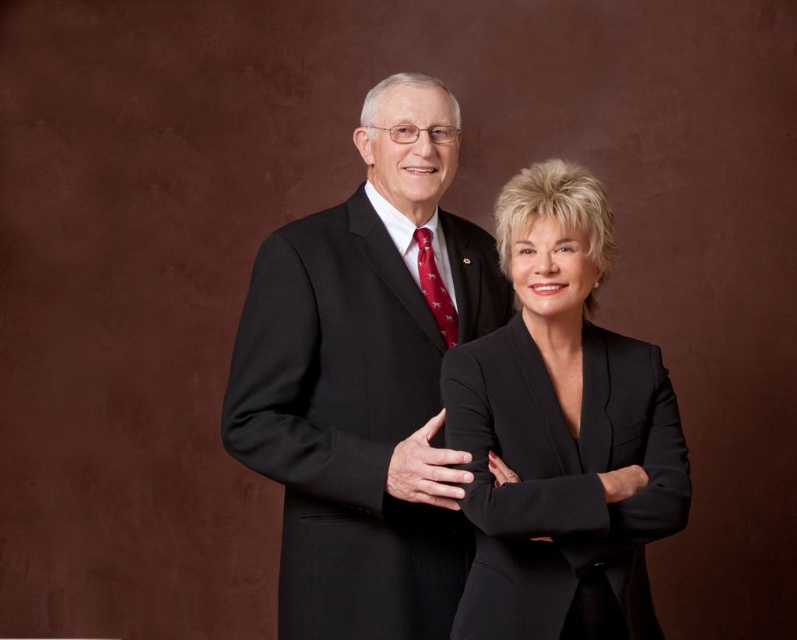
Can you confirm if matte black suit at center is positioned below black matte suit at center?

Incorrect, matte black suit at center is not positioned below black matte suit at center.

Which is behind, point (383, 353) or point (583, 483)?

The point (383, 353) is more distant.

Which is in front, point (375, 353) or point (505, 579)?

Point (505, 579)

You are a GUI agent. You are given a task and a screenshot of the screen. Output one action in this format:
    pyautogui.click(x=<x>, y=<y>)
    Task: Click on the matte black suit at center
    The width and height of the screenshot is (797, 640).
    Given the screenshot: What is the action you would take?
    pyautogui.click(x=366, y=380)